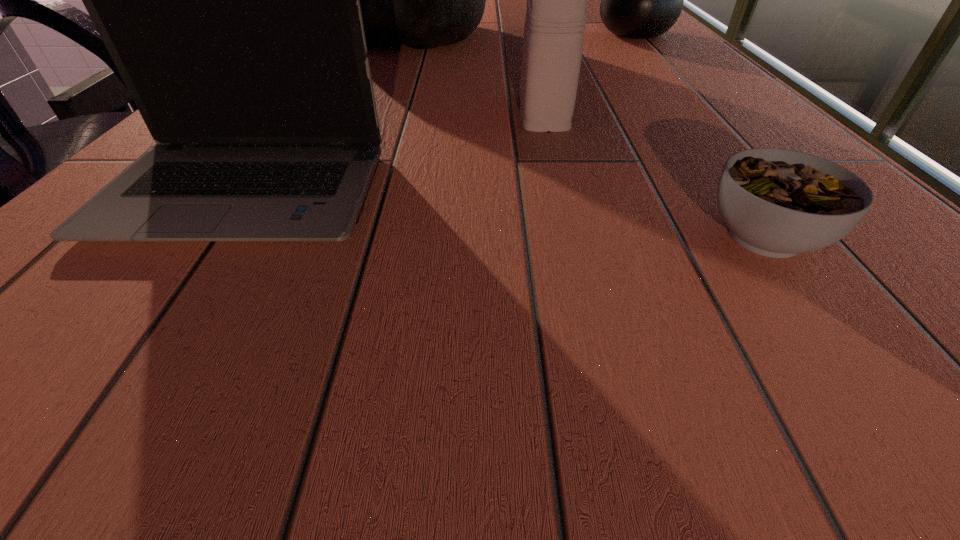
Identify which object is located as the third nearest to the vase. Please provide its 2D coordinates. Your answer should be formatted as a tuple, i.e. [(x, y)], where the tuple contains the x and y coordinates of a point satisfying the conditions above.

[(777, 203)]

You are a GUI agent. You are given a task and a screenshot of the screen. Output one action in this format:
    pyautogui.click(x=<x>, y=<y>)
    Task: Click on the object that is the second closest one to the soup bowl
    This screenshot has width=960, height=540.
    Given the screenshot: What is the action you would take?
    [x=229, y=0]

Find the location of a particular element. vacant position in the image that satisfies the following two spatial constraints: 1. on the screen of the laptop computer; 2. on the right side of the shortest object is located at coordinates (x=213, y=237).

The width and height of the screenshot is (960, 540). Find the location of `vacant space that satisfies the following two spatial constraints: 1. on the screen of the laptop computer; 2. on the right side of the soup bowl`. vacant space that satisfies the following two spatial constraints: 1. on the screen of the laptop computer; 2. on the right side of the soup bowl is located at coordinates (213, 237).

Where is `vacant space that satisfies the following two spatial constraints: 1. on the screen of the shortest object; 2. on the left side of the laptop computer`? The width and height of the screenshot is (960, 540). vacant space that satisfies the following two spatial constraints: 1. on the screen of the shortest object; 2. on the left side of the laptop computer is located at coordinates (213, 237).

Locate an element on the screen. This screenshot has width=960, height=540. vacant area that satisfies the following two spatial constraints: 1. on the handle side of the third farthest object; 2. on the left side of the vase is located at coordinates (x=523, y=34).